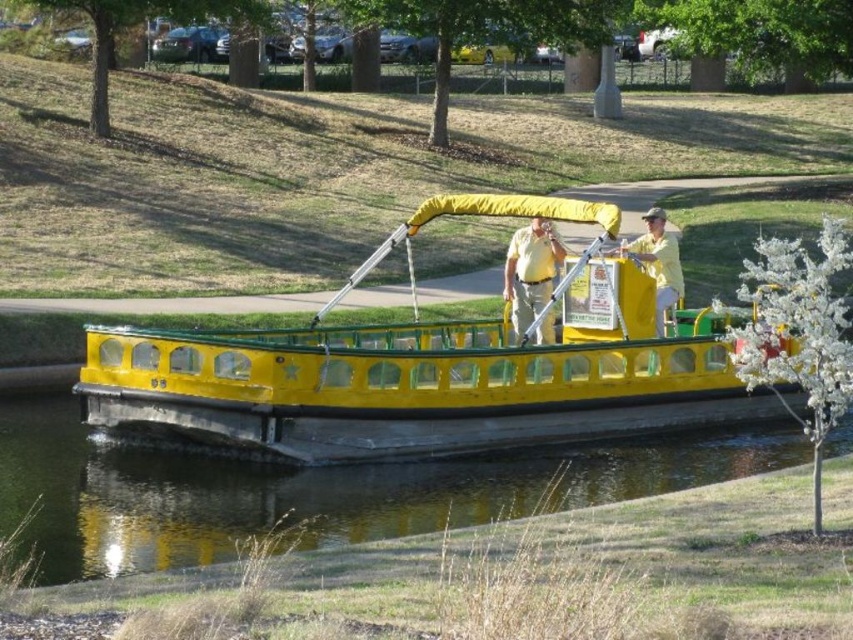
Question: Is yellow matte boat at center to the right of yellow matte shirt at center from the viewer's perspective?

Choices:
 (A) no
 (B) yes

Answer: (B)

Question: Which object appears farthest from the camera in this image?

Choices:
 (A) yellow matte shirt at upper center
 (B) yellow matte shirt at center

Answer: (A)

Question: Which object is positioned closest to the yellow matte shirt at center?

Choices:
 (A) yellow matte shirt at upper center
 (B) yellow rubber boat at center
 (C) yellow matte boat at center

Answer: (A)

Question: Which point is farther to the camera?

Choices:
 (A) yellow matte shirt at center
 (B) yellow rubber boat at center
 (C) yellow matte boat at center

Answer: (A)

Question: Does yellow matte boat at center appear on the right side of yellow matte shirt at upper center?

Choices:
 (A) no
 (B) yes

Answer: (A)

Question: Does yellow matte boat at center have a lesser width compared to yellow matte shirt at center?

Choices:
 (A) yes
 (B) no

Answer: (A)